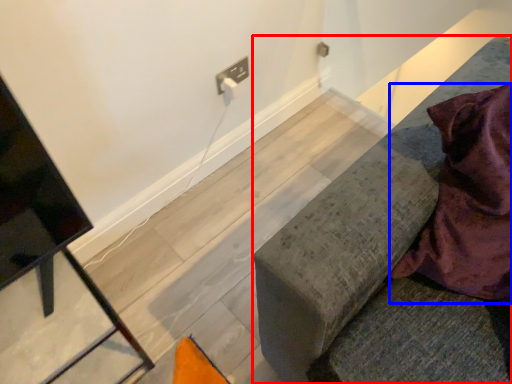
Question: Among these objects, which one is nearest to the camera, furniture (highlighted by a red box) or blanket (highlighted by a blue box)?

Choices:
 (A) furniture
 (B) blanket

Answer: (A)